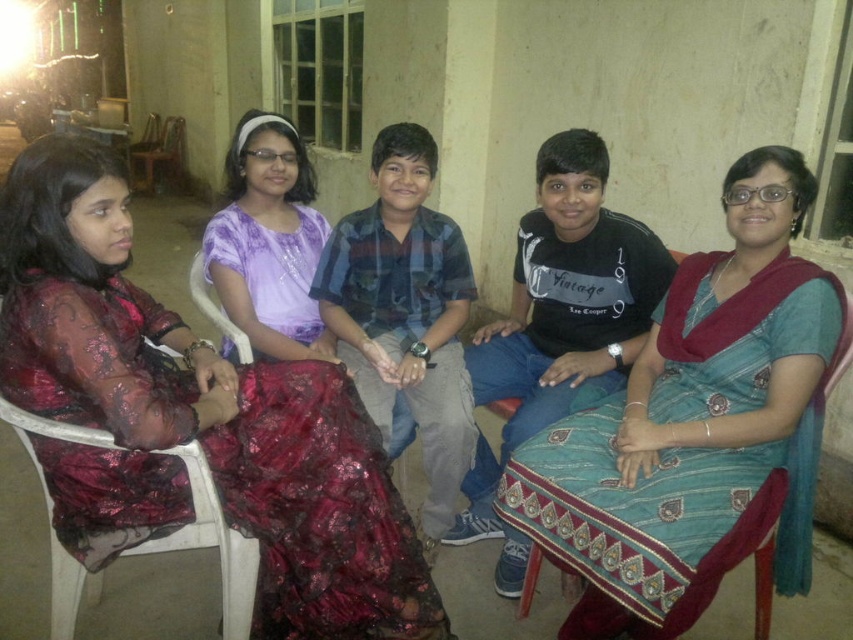
You are organizing a small indoor event and need to ensure there is enough space between the teal silk saree at center and the white plastic chair at left for attendees to move comfortably. The minimum required space is 1 meter. Based on the image, can you determine if the space between them is sufficient?

The teal silk saree at center has a width larger than the white plastic chair at left, but the description does not provide the exact distance between them. Therefore, it is unclear if the space between them meets the 1 meter requirement.

You are a photographer setting up for an event. You notice the teal silk saree at center and the white plastic chair at left in the scene. Which object is positioned higher in the image?

The teal silk saree at center is located above the white plastic chair at left, so it is positioned higher in the image.

You are planning to seat guests in this room and need to accommodate a guest who requires a wider chair. Based on the image, which chair between the white plastic chair at left and the white plastic chair at upper left would be more suitable for this guest?

The white plastic chair at left has a larger width than the white plastic chair at upper left, so it would be more suitable for the guest requiring a wider chair.